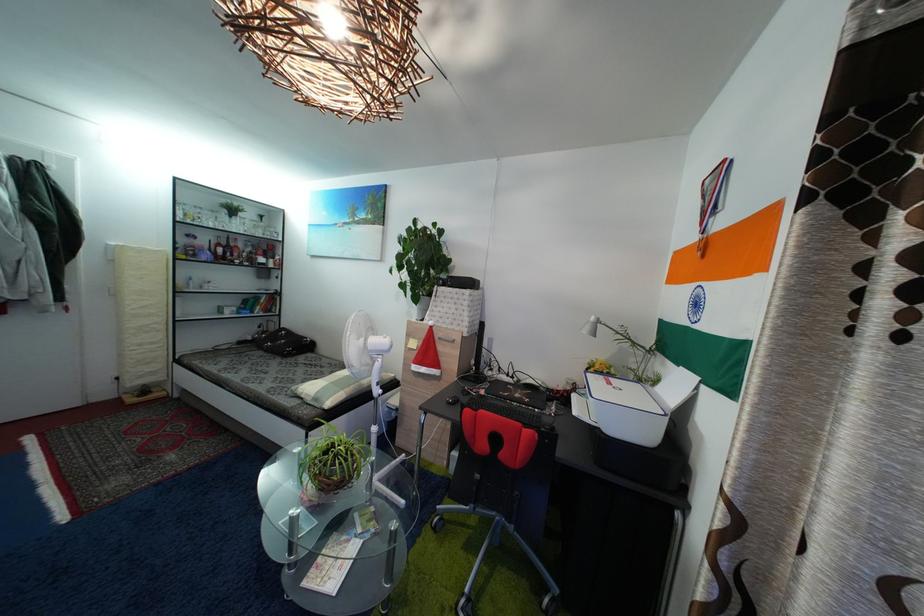
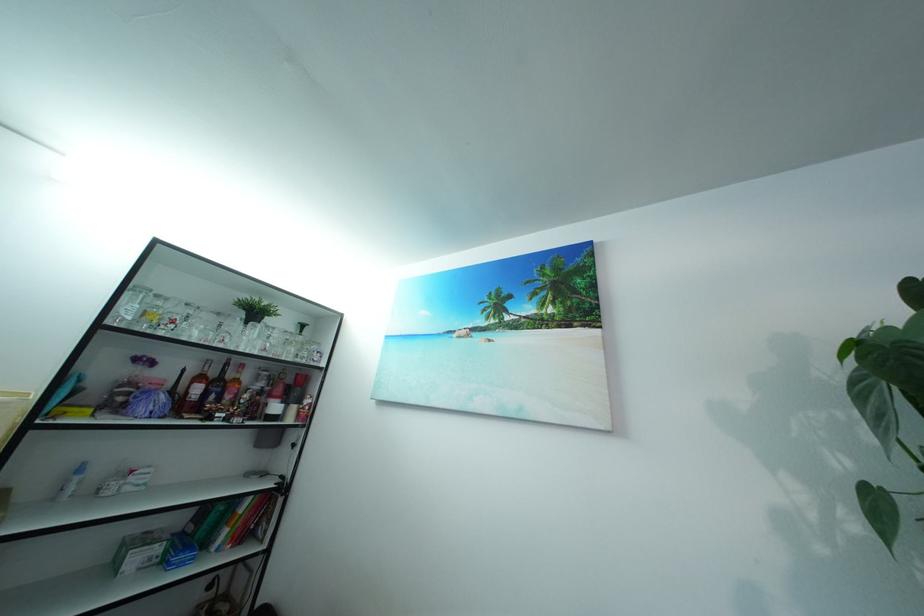
In the second image, find the point that corresponds to point 237,254 in the first image.

(226, 391)